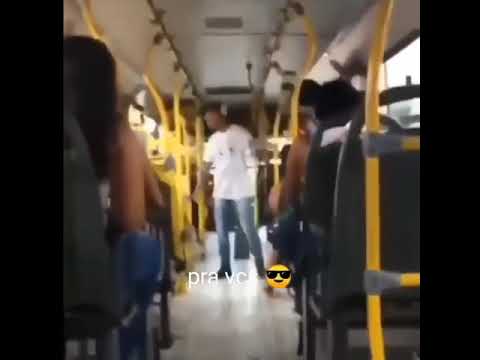
This screenshot has height=360, width=480. I want to click on black trim, so tap(27, 178), tap(445, 166).